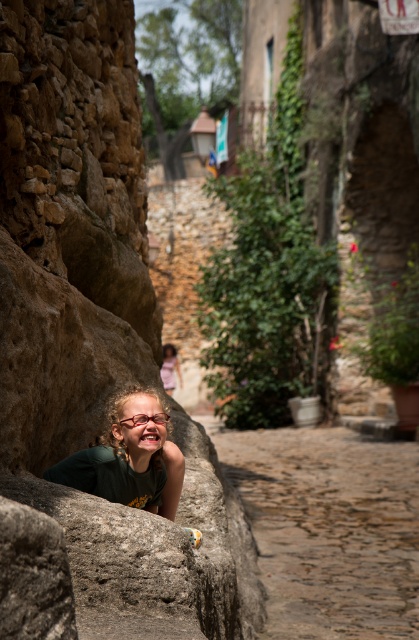
Is brown rough stone at lower left below green fabric face at lower left?

No, brown rough stone at lower left is not below green fabric face at lower left.

This screenshot has width=419, height=640. Describe the element at coordinates (93, 349) in the screenshot. I see `brown rough stone at lower left` at that location.

This screenshot has width=419, height=640. In order to click on brown rough stone at lower left in this screenshot , I will do `click(93, 349)`.

Can you confirm if brown rough stone at lower left is positioned below matte pink dress at center?

No, brown rough stone at lower left is not below matte pink dress at center.

You are a GUI agent. You are given a task and a screenshot of the screen. Output one action in this format:
    pyautogui.click(x=<x>, y=<y>)
    Task: Click on the brown rough stone at lower left
    
    Given the screenshot: What is the action you would take?
    pyautogui.click(x=93, y=349)

Does point (10, 282) come behind point (173, 356)?

No, it is not.

Where is `brown rough stone at lower left`? brown rough stone at lower left is located at coordinates (93, 349).

Can you confirm if green fabric face at lower left is positioned to the left of matte pink dress at center?

Incorrect, green fabric face at lower left is not on the left side of matte pink dress at center.

Measure the distance between green fabric face at lower left and camera.

green fabric face at lower left and camera are 21.17 feet apart.

Is point (137, 401) positioned after point (167, 387)?

No, (137, 401) is in front of (167, 387).

Locate an element on the screen. The height and width of the screenshot is (640, 419). green fabric face at lower left is located at coordinates (129, 458).